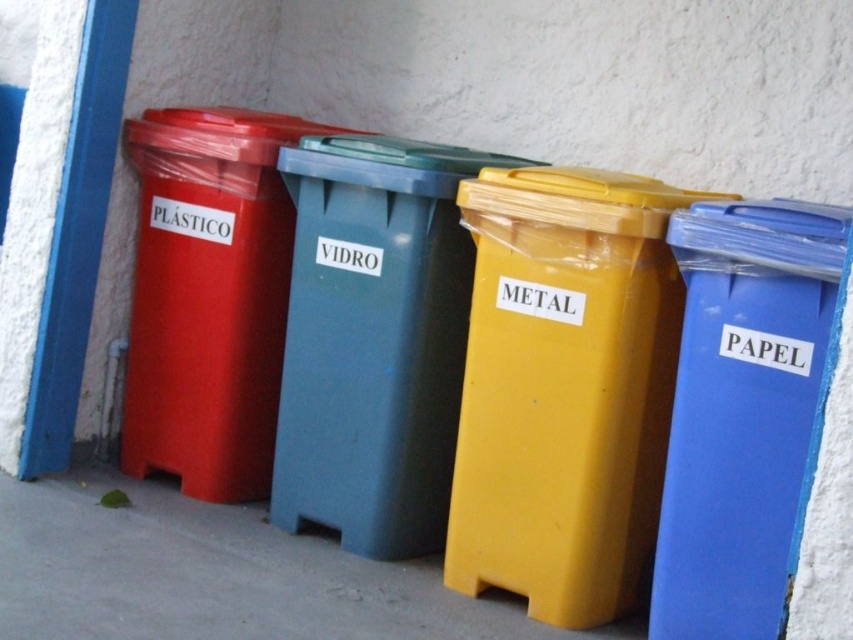
Question: Among these objects, which one is farthest from the camera?

Choices:
 (A) yellow plastic/metallic trash can at center
 (B) matte plastic bin at left
 (C) yellow matte plastic bin at lower center
 (D) yellow matte metal bin at center

Answer: (B)

Question: Which of these objects is positioned closest to the yellow plastic/metallic trash can at center?

Choices:
 (A) matte plastic bin at left
 (B) blue plastic paper at right
 (C) matte plastic trash can at left

Answer: (C)

Question: Is yellow plastic/metallic trash can at center behind blue plastic paper at right?

Choices:
 (A) no
 (B) yes

Answer: (B)

Question: Is yellow plastic/metallic trash can at center to the right of yellow matte plastic bin at lower center from the viewer's perspective?

Choices:
 (A) no
 (B) yes

Answer: (B)

Question: Is yellow plastic/metallic trash can at center to the left of matte plastic bin at left from the viewer's perspective?

Choices:
 (A) yes
 (B) no

Answer: (B)

Question: Based on their relative distances, which object is farther from the blue plastic paper at right?

Choices:
 (A) yellow plastic/metallic trash can at center
 (B) yellow matte plastic bin at lower center

Answer: (B)